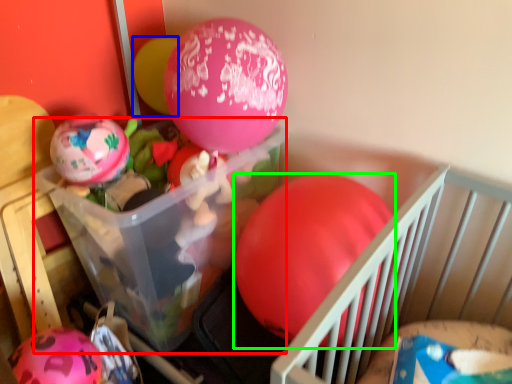
Question: Based on their relative distances, which object is nearer to storage box (highlighted by a red box)? Choose from balloon (highlighted by a blue box) and balloon (highlighted by a green box).

Choices:
 (A) balloon
 (B) balloon

Answer: (B)